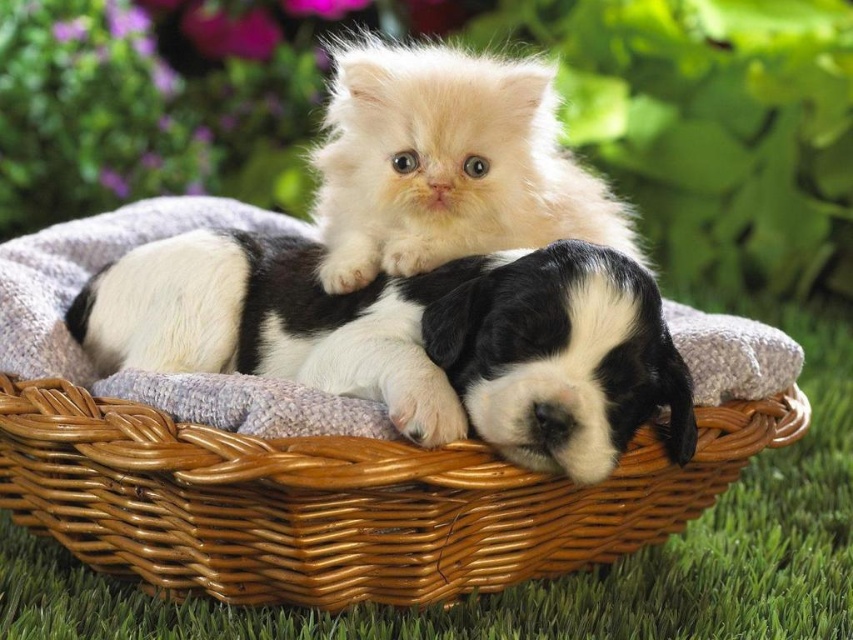
You are standing in the garden looking at the basket with the kitten and puppy. There are two points marked in the image. Which point is closer to you, point at coordinate [210,589] or point at coordinate [564,376]?

Point at coordinate [210,589] is closer to you because it is further to the viewer than point at coordinate [564,376].

You are standing in the garden and want to place a small toy between the two points, point (469, 509) and point (543, 74). Which point should the toy be closer to so it is in front of both?

The toy should be closer to point (469, 509) because it is in front of point (543, 74).

You are organizing a pet show and need to ensure that the woven brown basket at center can comfortably accommodate both the fluffy white cat at upper center and a small dog. Based on the size comparison between the basket and the cat, do you think there is enough space for both animals?

The woven brown basket at center has a larger size compared to the fluffy white cat at upper center. Since the basket is bigger than the cat, there should be sufficient space to accommodate both the cat and the small dog.